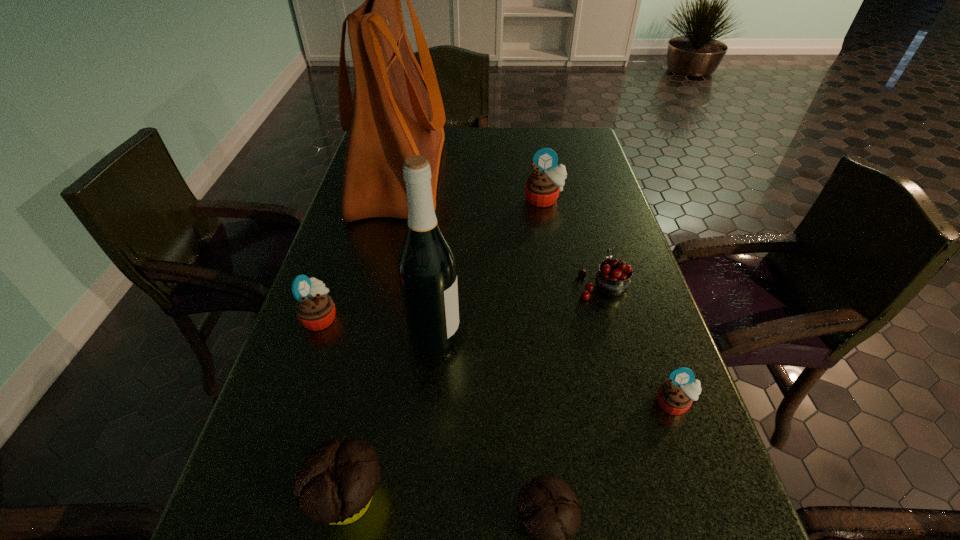
This screenshot has width=960, height=540. Identify the location of the tallest object. (396, 112).

Locate an element on the screen. This screenshot has height=540, width=960. shopping bag is located at coordinates (396, 112).

The width and height of the screenshot is (960, 540). Identify the location of the seventh shortest object. (427, 269).

Find the location of a particular element. wine bottle is located at coordinates (427, 269).

What are the coordinates of `the tallest muffin` in the screenshot? It's located at click(542, 188).

I want to click on the third tallest object, so click(542, 188).

Where is `the second biggest pink muffin`? Image resolution: width=960 pixels, height=540 pixels. the second biggest pink muffin is located at coordinates (315, 310).

Locate an element on the screen. This screenshot has width=960, height=540. the leftmost muffin is located at coordinates (315, 310).

You are a GUI agent. You are given a task and a screenshot of the screen. Output one action in this format:
    pyautogui.click(x=<x>, y=<y>)
    Task: Click on the red cherry
    The image size is (960, 540).
    Given the screenshot: What is the action you would take?
    pyautogui.click(x=613, y=279)

Locate an element on the screen. The image size is (960, 540). the rightmost pink muffin is located at coordinates (675, 396).